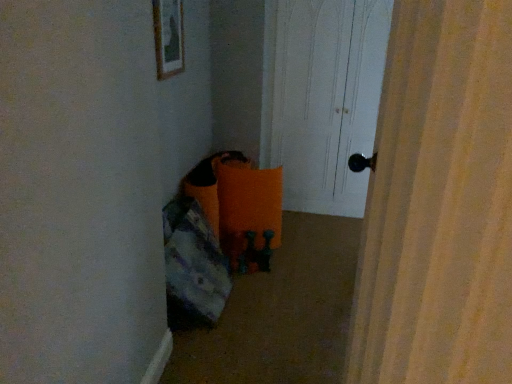
Identify the location of orange fabric bean bag at lower left. (193, 266).

The height and width of the screenshot is (384, 512). What do you see at coordinates (327, 99) in the screenshot? I see `white wood door at center` at bounding box center [327, 99].

The height and width of the screenshot is (384, 512). I want to click on white wood door at center, so click(327, 99).

What is the approximate width of matte wooden picture frame at upper center?

1.87 inches.

I want to click on orange fabric bean bag at lower left, so click(193, 266).

Considering the sizes of objects white wood door at center and matte wooden picture frame at upper center in the image provided, who is wider, white wood door at center or matte wooden picture frame at upper center?

white wood door at center is wider.

From a real-world perspective, relative to matte wooden picture frame at upper center, is white wood door at center vertically above or below?

white wood door at center is below matte wooden picture frame at upper center.

From the image's perspective, is white wood door at center located above matte wooden picture frame at upper center?

Actually, white wood door at center appears below matte wooden picture frame at upper center in the image.

Between orange fabric bean bag at lower left and matte wooden picture frame at upper center, which one has larger width?

With larger width is orange fabric bean bag at lower left.

Is there a large distance between orange fabric bean bag at lower left and matte wooden picture frame at upper center?

orange fabric bean bag at lower left is near matte wooden picture frame at upper center, not far away.

Can you confirm if orange fabric bean bag at lower left is bigger than matte wooden picture frame at upper center?

Yes, orange fabric bean bag at lower left is bigger than matte wooden picture frame at upper center.

In the scene shown: How different are the orientations of orange fabric bean bag at lower left and matte wooden picture frame at upper center in degrees?

The facing directions of orange fabric bean bag at lower left and matte wooden picture frame at upper center are 0.0124 degrees apart.

Is white wood door at center a part of orange fabric bean bag at lower left?

No, white wood door at center is not surrounded by orange fabric bean bag at lower left.

Does orange fabric bean bag at lower left have a larger size compared to white wood door at center?

Actually, orange fabric bean bag at lower left might be smaller than white wood door at center.

From the image's perspective, which is below, orange fabric bean bag at lower left or white wood door at center?

orange fabric bean bag at lower left, from the image's perspective.

From the picture: Can you see matte wooden picture frame at upper center touching white wood door at center?

No, matte wooden picture frame at upper center is not with white wood door at center.

From the image's perspective, is matte wooden picture frame at upper center located above white wood door at center?

Yes, from the image's perspective, matte wooden picture frame at upper center is above white wood door at center.

In order to click on screen door below the matte wooden picture frame at upper center (from the image's perspective) in this screenshot , I will do `click(327, 99)`.

Considering the sizes of objects matte wooden picture frame at upper center and white wood door at center in the image provided, who is bigger, matte wooden picture frame at upper center or white wood door at center?

white wood door at center is bigger.

Would you say matte wooden picture frame at upper center contains orange fabric bean bag at lower left?

No, orange fabric bean bag at lower left is not inside matte wooden picture frame at upper center.

Considering the points (168, 46) and (168, 279), which point is in front, point (168, 46) or point (168, 279)?

Point (168, 46)

From a real-world perspective, is matte wooden picture frame at upper center above or below orange fabric bean bag at lower left?

matte wooden picture frame at upper center is situated higher than orange fabric bean bag at lower left in the real world.

From the image's perspective, does matte wooden picture frame at upper center appear higher than orange fabric bean bag at lower left?

Yes, from the image's perspective, matte wooden picture frame at upper center is on top of orange fabric bean bag at lower left.

Would you say white wood door at center is inside or outside orange fabric bean bag at lower left?

white wood door at center exists outside the volume of orange fabric bean bag at lower left.

Can you confirm if white wood door at center is positioned to the right of orange fabric bean bag at lower left?

Yes.

From a real-world perspective, who is located higher, white wood door at center or orange fabric bean bag at lower left?

From a 3D spatial view, white wood door at center is above.

Which object is further away from the camera taking this photo, white wood door at center or orange fabric bean bag at lower left?

white wood door at center is more distant.

Image resolution: width=512 pixels, height=384 pixels. What are the coordinates of `screen door that is on the right side of matte wooden picture frame at upper center` in the screenshot? It's located at (327, 99).

Identify the location of bean bag chair in front of the matte wooden picture frame at upper center. This screenshot has height=384, width=512. (193, 266).

When comparing their distances from white wood door at center, does orange fabric bean bag at lower left or matte wooden picture frame at upper center seem closer?

Based on the image, matte wooden picture frame at upper center appears to be nearer to white wood door at center.

From the picture: Which object lies nearer to the anchor point matte wooden picture frame at upper center, orange fabric bean bag at lower left or white wood door at center?

Answer: orange fabric bean bag at lower left is positioned closer to the anchor matte wooden picture frame at upper center.

When comparing their distances from orange fabric bean bag at lower left, does matte wooden picture frame at upper center or white wood door at center seem further?

white wood door at center.

Which object lies nearer to the anchor point white wood door at center, matte wooden picture frame at upper center or orange fabric bean bag at lower left?

Among the two, matte wooden picture frame at upper center is located nearer to white wood door at center.

Looking at the image, which one is located closer to matte wooden picture frame at upper center, white wood door at center or orange fabric bean bag at lower left?

orange fabric bean bag at lower left is closer to matte wooden picture frame at upper center.

When comparing their distances from orange fabric bean bag at lower left, does white wood door at center or matte wooden picture frame at upper center seem further?

white wood door at center is further to orange fabric bean bag at lower left.

Where is `screen door between matte wooden picture frame at upper center and orange fabric bean bag at lower left in the vertical direction`? This screenshot has width=512, height=384. screen door between matte wooden picture frame at upper center and orange fabric bean bag at lower left in the vertical direction is located at coordinates (327, 99).